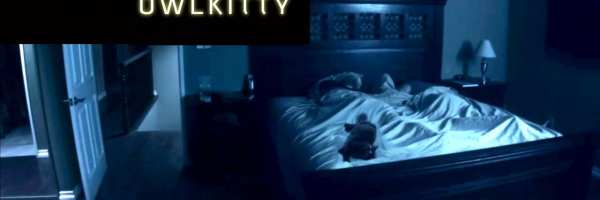
Identify the location of book. (467, 82).